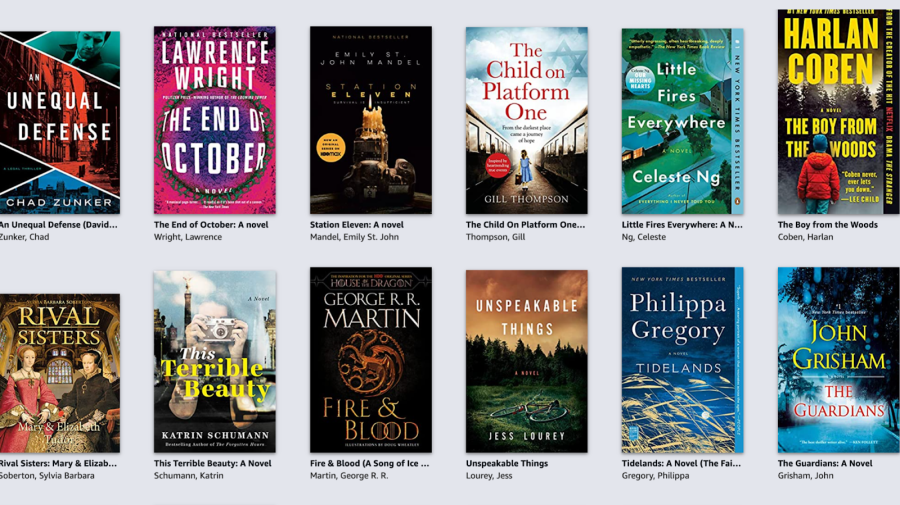
Locate an element on the screen. The width and height of the screenshot is (900, 505). books in bottom row is located at coordinates (61, 378), (239, 378), (331, 380), (552, 342), (695, 337), (862, 363).